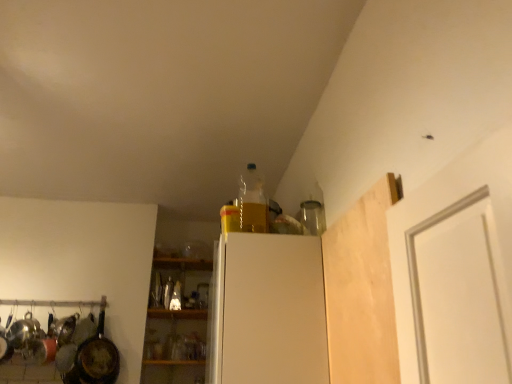
Question: Is translucent glass bottle at center, placed as the second bottle when sorted from top to bottom, thinner than translucent plastic bottle at upper center, marked as the 1th bottle in a right-to-left arrangement?

Choices:
 (A) yes
 (B) no

Answer: (B)

Question: Can you confirm if translucent glass bottle at center, which is counted as the 2th bottle, starting from the bottom, is shorter than translucent plastic bottle at upper center, placed as the third bottle when sorted from bottom to top?

Choices:
 (A) yes
 (B) no

Answer: (A)

Question: Is translucent glass bottle at center, which ranks as the 1th bottle in left-to-right order, oriented away from translucent plastic bottle at upper center, the third bottle in the left-to-right sequence?

Choices:
 (A) yes
 (B) no

Answer: (B)

Question: Is the surface of translucent glass bottle at center, placed as the second bottle when sorted from top to bottom, in direct contact with translucent plastic bottle at upper center, placed as the third bottle when sorted from bottom to top?

Choices:
 (A) yes
 (B) no

Answer: (B)

Question: Is translucent glass bottle at center, which ranks as the 1th bottle in left-to-right order, bigger than translucent plastic bottle at upper center, the third bottle in the left-to-right sequence?

Choices:
 (A) yes
 (B) no

Answer: (B)

Question: In terms of width, does rusty metal frying pan at left look wider or thinner when compared to translucent glass bottle at center, which is the third bottle in right-to-left order?

Choices:
 (A) wide
 (B) thin

Answer: (A)

Question: Relative to translucent glass bottle at center, which is the second bottle from front to back, is rusty metal frying pan at left in front or behind?

Choices:
 (A) front
 (B) behind

Answer: (A)

Question: Looking at the image, does rusty metal frying pan at left seem bigger or smaller compared to translucent glass bottle at center, which ranks as the 2th bottle in back-to-front order?

Choices:
 (A) big
 (B) small

Answer: (A)

Question: From the image's perspective, is rusty metal frying pan at left above or below translucent glass bottle at center, which is the third bottle in right-to-left order?

Choices:
 (A) below
 (B) above

Answer: (A)

Question: From the image's perspective, is translucent glass bottle at center, which appears as the 3th bottle when viewed from the front, above or below translucent glass bottle at center, which ranks as the 1th bottle in left-to-right order?

Choices:
 (A) below
 (B) above

Answer: (A)

Question: Is translucent glass bottle at center, the 1th bottle positioned from the back, wider or thinner than translucent glass bottle at center, which ranks as the 2th bottle in back-to-front order?

Choices:
 (A) thin
 (B) wide

Answer: (B)

Question: Which is correct: translucent glass bottle at center, which ranks as the second bottle in left-to-right order, is inside translucent glass bottle at center, which is the second bottle from front to back, or outside of it?

Choices:
 (A) inside
 (B) outside

Answer: (B)

Question: In terms of height, does translucent glass bottle at center, the 1th bottle ordered from the bottom, look taller or shorter compared to translucent glass bottle at center, which is the third bottle in right-to-left order?

Choices:
 (A) short
 (B) tall

Answer: (A)

Question: Choose the correct answer: Is rusty metal frying pan at left inside light wood/rough plank at upper right or outside it?

Choices:
 (A) outside
 (B) inside

Answer: (A)

Question: From the image's perspective, relative to light wood/rough plank at upper right, is rusty metal frying pan at left above or below?

Choices:
 (A) below
 (B) above

Answer: (A)